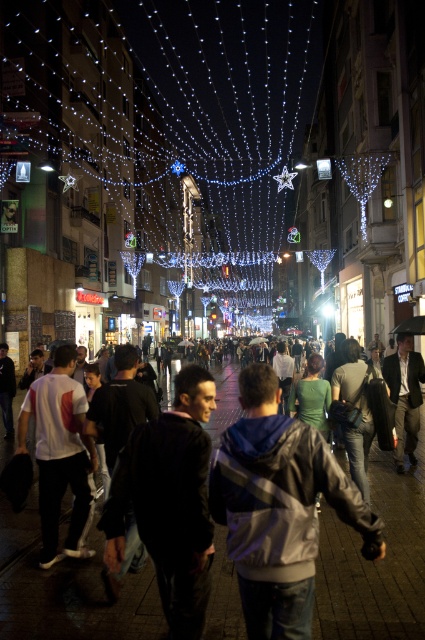
Can you confirm if illuminated string lights at center is taller than dark clothing crowd at center?

Yes, illuminated string lights at center is taller than dark clothing crowd at center.

Is illuminated string lights at center above dark clothing crowd at center?

Yes.

The image size is (425, 640). What do you see at coordinates (150, 156) in the screenshot?
I see `illuminated string lights at center` at bounding box center [150, 156].

The height and width of the screenshot is (640, 425). What are the coordinates of `illuminated string lights at center` in the screenshot? It's located at (150, 156).